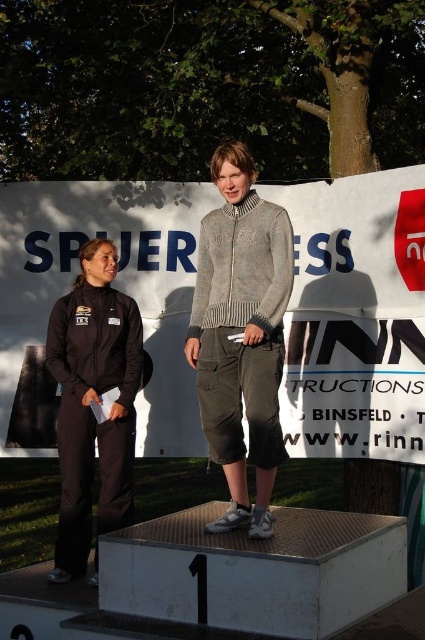
Question: In this image, where is knitted sweater at center located relative to black matte tracksuit at left?

Choices:
 (A) above
 (B) below

Answer: (A)

Question: Is knitted sweater at center wider than black matte tracksuit at left?

Choices:
 (A) no
 (B) yes

Answer: (A)

Question: Which point is farther from the camera taking this photo?

Choices:
 (A) (76, 300)
 (B) (271, 388)

Answer: (A)

Question: Does knitted sweater at center have a larger size compared to black matte tracksuit at left?

Choices:
 (A) yes
 (B) no

Answer: (B)

Question: Which point is closer to the camera?

Choices:
 (A) (73, 532)
 (B) (231, 396)

Answer: (B)